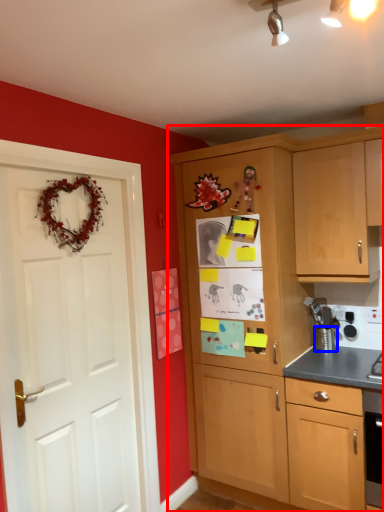
Question: Which point is further to the camera, cabinetry (highlighted by a red box) or appliance (highlighted by a blue box)?

Choices:
 (A) cabinetry
 (B) appliance

Answer: (B)